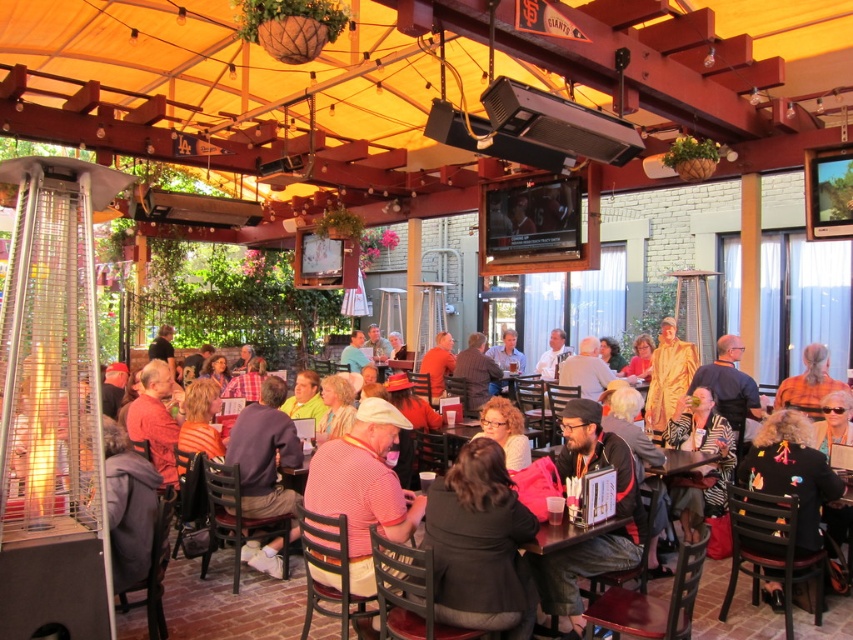
Question: Is dark blue sweater at center positioned behind black fuzzy coat at lower right?

Choices:
 (A) yes
 (B) no

Answer: (A)

Question: Among these objects, which one is farthest from the camera?

Choices:
 (A) black fuzzy coat at lower right
 (B) dark blue sweater at center
 (C) orange shirt at center

Answer: (C)

Question: Is the position of striped cotton shirt at center less distant than that of dark gray knit cap at center?

Choices:
 (A) no
 (B) yes

Answer: (B)

Question: Which point is farther to the camera?

Choices:
 (A) dark gray sweater at center
 (B) striped cotton shirt at center
 (C) black fuzzy coat at lower right
 (D) dark blue sweater at center

Answer: (D)

Question: Is dark blue sweater at center to the right of orange shirt at center from the viewer's perspective?

Choices:
 (A) yes
 (B) no

Answer: (B)

Question: Among these objects, which one is farthest from the camera?

Choices:
 (A) dark gray knit cap at center
 (B) orange shirt at center

Answer: (B)